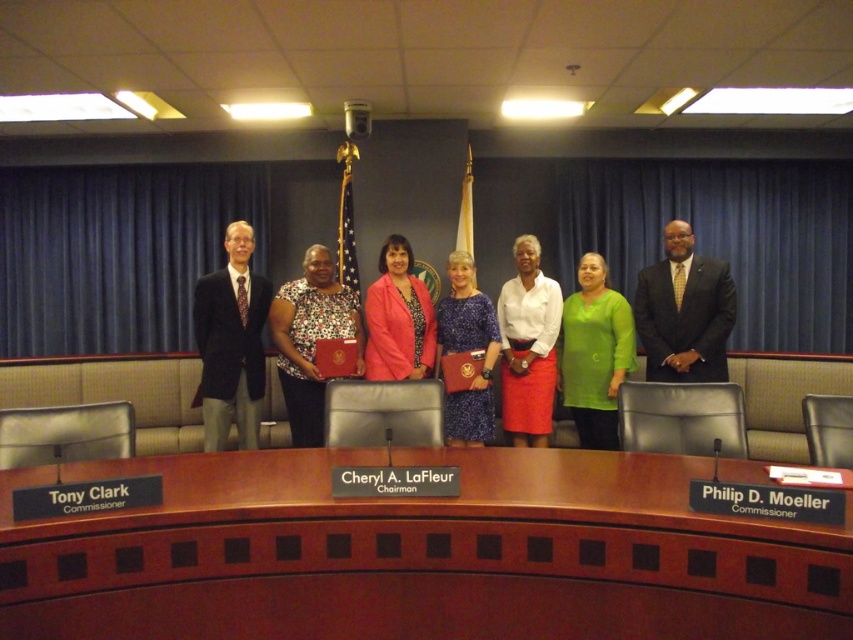
You are a photographer standing 2 meters away from the camera. You need to adjust the focus to capture the white matte blouse at center clearly. What is the minimum distance you should set the focus to?

The white matte blouse at center is 4.22 meters away from the camera. Since you are 2 meters away from the camera, the total distance between you and the blouse is 6.22 meters. To focus on the blouse, the focus should be set to at least 6.22 meters.

You are a photographer standing at point A. There is a point B at coordinates point (230, 419). You want to take a photo of the group such that both you and point B are in frame. Given that your camera has a 90 degree field of view, will you be able to capture both yourself and point B in the same photo?

Since the distance between you and point B is 3.99 meters, and your camera has a 90 degree field of view, you can capture both yourself and point B in the same photo as the field of view allows for that distance.

You are a photographer who needs to adjust the lighting for the group photo. You notice the dark gray suit at left and the green matte shirt at center. Which person should you adjust the lighting for first to ensure their clothing colors are properly captured, considering their position?

The dark gray suit at left should be adjusted first since it is positioned to the left of the green matte shirt at center, making it closer to the left side where lighting adjustments might be needed first.